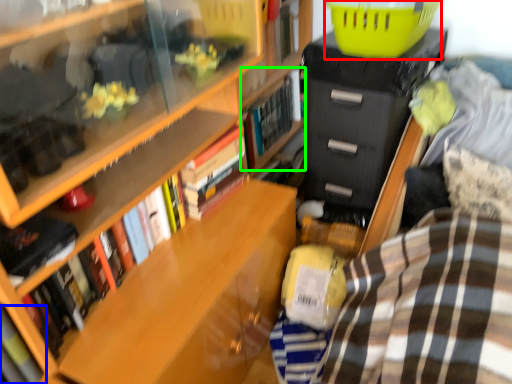
Question: Estimate the real-world distances between objects in this image. Which object is closer to basket (highlighted by a red box), book (highlighted by a blue box) or book (highlighted by a green box)?

Choices:
 (A) book
 (B) book

Answer: (B)